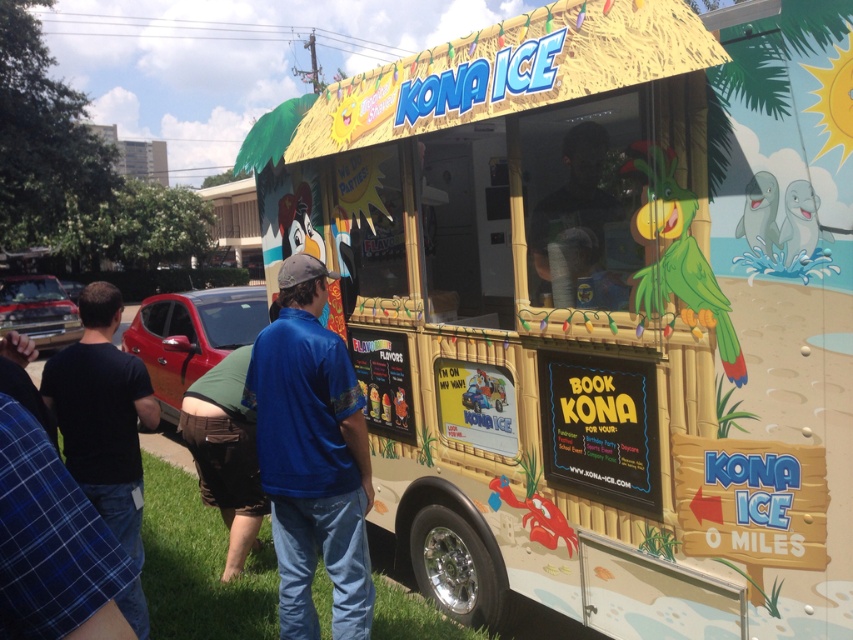
Question: Which of the following is the farthest from the observer?

Choices:
 (A) beige bamboo food truck at center
 (B) matte black shirt at center

Answer: (B)

Question: Considering the real-world distances, which object is farthest from the blue denim jeans at lower center?

Choices:
 (A) beige bamboo food truck at center
 (B) black cotton shirt at lower left

Answer: (A)

Question: Which object is positioned closest to the beige bamboo food truck at center?

Choices:
 (A) matte black shirt at center
 (B) blue denim jeans at lower center
 (C) black cotton shirt at lower left

Answer: (A)

Question: Is beige bamboo food truck at center to the left of black cotton shirt at lower left from the viewer's perspective?

Choices:
 (A) yes
 (B) no

Answer: (B)

Question: From the image, what is the correct spatial relationship of beige bamboo food truck at center in relation to black cotton shirt at lower left?

Choices:
 (A) right
 (B) left

Answer: (A)

Question: Where is beige bamboo food truck at center located in relation to matte black shirt at center in the image?

Choices:
 (A) right
 (B) left

Answer: (B)